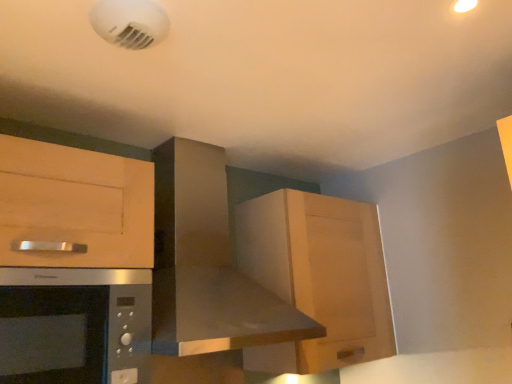
Question: Considering the relative sizes of satin silver microwave at lower left and wooden cabinet at upper right in the image provided, is satin silver microwave at lower left bigger than wooden cabinet at upper right?

Choices:
 (A) no
 (B) yes

Answer: (A)

Question: Does satin silver microwave at lower left have a lesser height compared to wooden cabinet at upper right?

Choices:
 (A) no
 (B) yes

Answer: (B)

Question: Is satin silver microwave at lower left in contact with wooden cabinet at upper right?

Choices:
 (A) yes
 (B) no

Answer: (B)

Question: Does satin silver microwave at lower left have a smaller size compared to wooden cabinet at upper right?

Choices:
 (A) yes
 (B) no

Answer: (A)

Question: Considering the relative positions of satin silver microwave at lower left and wooden cabinet at upper right in the image provided, is satin silver microwave at lower left to the right of wooden cabinet at upper right from the viewer's perspective?

Choices:
 (A) yes
 (B) no

Answer: (B)

Question: Is stainless steel range hood at center wider or thinner than wooden cabinet at upper right?

Choices:
 (A) wide
 (B) thin

Answer: (A)

Question: Is stainless steel range hood at center taller or shorter than wooden cabinet at upper right?

Choices:
 (A) short
 (B) tall

Answer: (B)

Question: Is stainless steel range hood at center to the left or to the right of wooden cabinet at upper right in the image?

Choices:
 (A) left
 (B) right

Answer: (A)

Question: From a real-world perspective, is stainless steel range hood at center physically located above or below wooden cabinet at upper right?

Choices:
 (A) above
 (B) below

Answer: (A)

Question: Is satin silver microwave at lower left inside or outside of stainless steel range hood at center?

Choices:
 (A) outside
 (B) inside

Answer: (A)

Question: From a real-world perspective, is satin silver microwave at lower left positioned above or below stainless steel range hood at center?

Choices:
 (A) below
 (B) above

Answer: (A)

Question: In terms of height, does satin silver microwave at lower left look taller or shorter compared to stainless steel range hood at center?

Choices:
 (A) tall
 (B) short

Answer: (B)

Question: From the image's perspective, relative to stainless steel range hood at center, is satin silver microwave at lower left above or below?

Choices:
 (A) above
 (B) below

Answer: (B)

Question: Relative to stainless steel range hood at center, is wooden cabinet at upper right in front or behind?

Choices:
 (A) behind
 (B) front

Answer: (A)

Question: In terms of size, does wooden cabinet at upper right appear bigger or smaller than stainless steel range hood at center?

Choices:
 (A) big
 (B) small

Answer: (B)